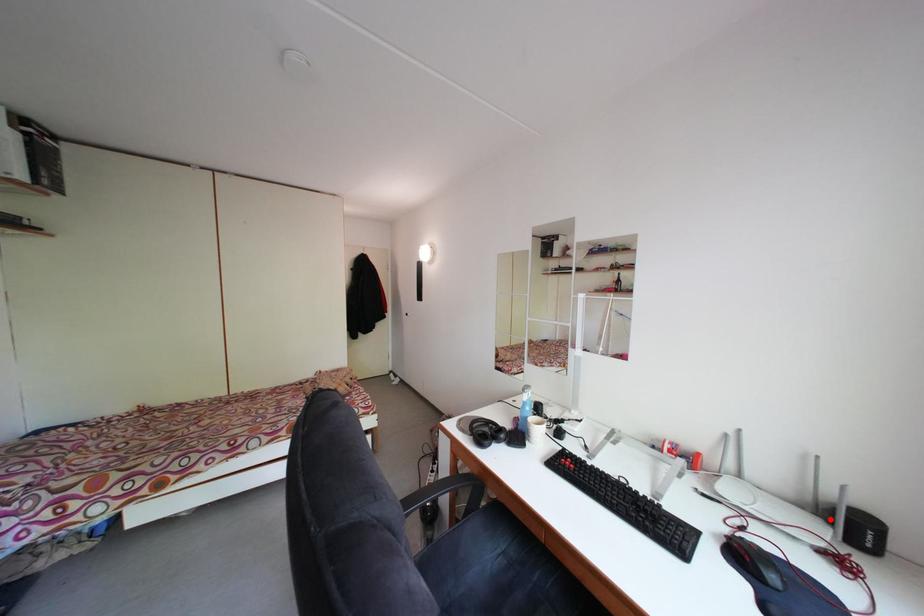
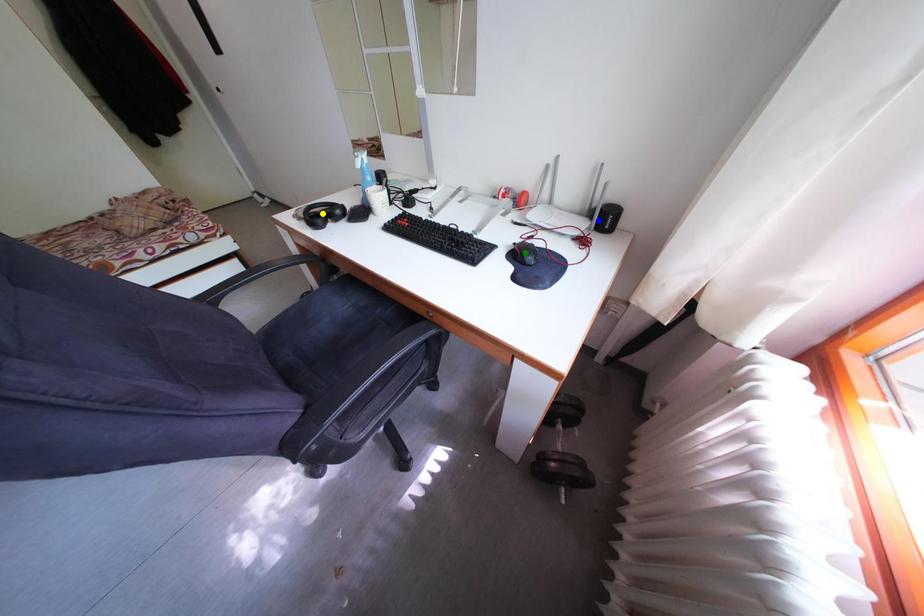
Question: I am providing you with two images of the same scene from different viewpoints. A red point is marked on the first image. You are given multiple points on the second image. In image 2, which mark is for the same physical point as the one in image 1?

Choices:
 (A) blue point
 (B) green point
 (C) yellow point

Answer: (A)